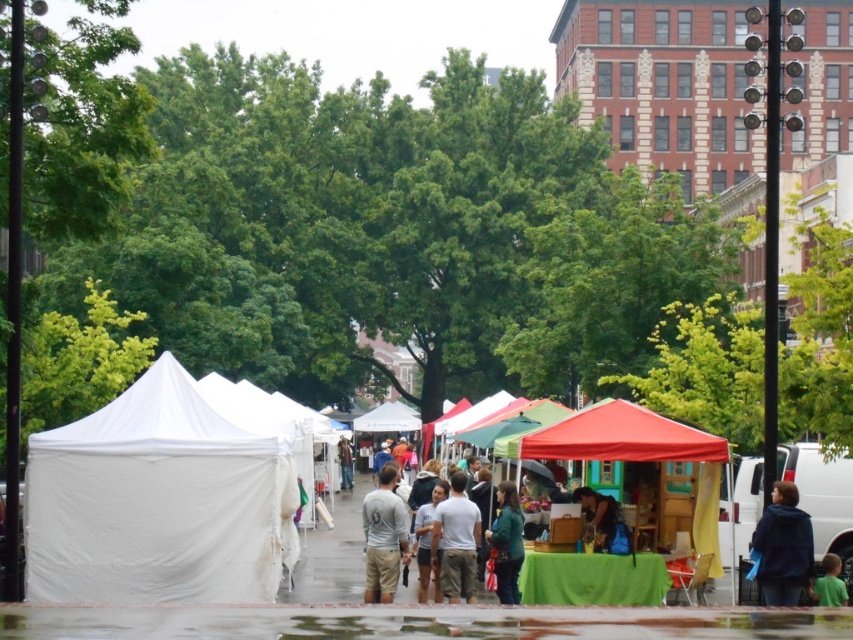
You are standing at the center of the market and want to find the white canvas tent at left. According to the coordinates provided, in which direction should you move to reach it?

The white canvas tent at left is located at coordinates point (158, 500). Since you are at the center, moving towards the left side of the market will lead you to the white canvas tent at left.

You are a customer at the outdoor market and want to find the dark blue fur coat at lower right. Which direction should you move from the white canvas tent at left to locate it?

The white canvas tent at left is to the left of the dark blue fur coat at lower right, so you should move to the right from the white canvas tent at left to locate the dark blue fur coat at lower right.

You are a customer at the market and want to approach the vendor stall with the red canopy. You notice two people wearing a green matte jacket at center and a light gray cotton shirt at center blocking your path. Which person should you ask to move aside so you can reach the stall more easily?

The green matte jacket at center is in front of the light gray cotton shirt at center, so you should ask the person wearing the green matte jacket at center to move aside since they are closer to you.